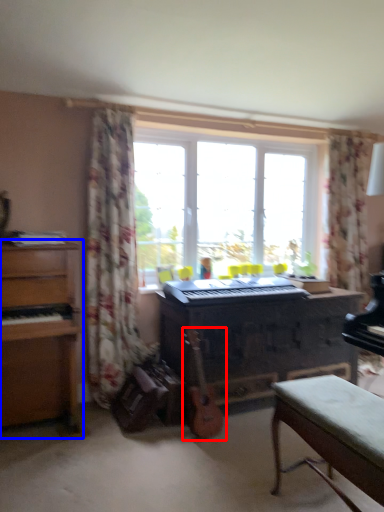
Question: Which point is further to the camera, guitar (highlighted by a red box) or chest of drawers (highlighted by a blue box)?

Choices:
 (A) guitar
 (B) chest of drawers

Answer: (A)